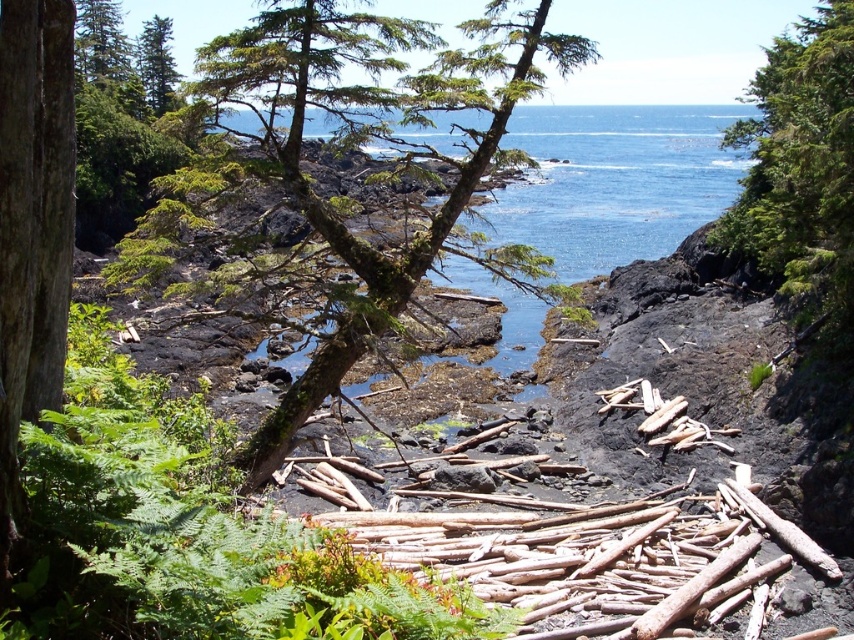
You are a hiker standing at the bottom of the image. You want to take a photo of the green mossy tree at upper center. In which direction should you point your camera to capture it?

You should point your camera upward because the green mossy tree at upper center is located above your position at point (800,168).

You are a hiker standing in the forest and see the green mossy bark tree at center and the green mossy tree at upper center. Which tree is positioned higher in the image?

The green mossy tree at upper center is positioned higher in the image than the green mossy bark tree at center.